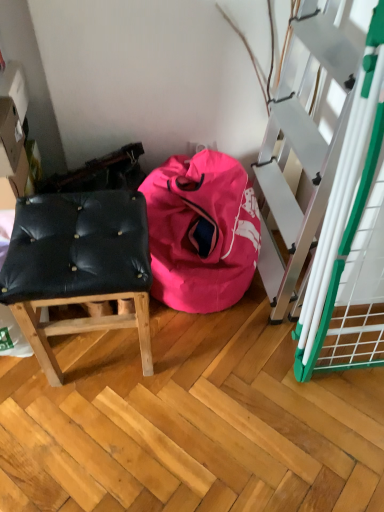
Question: Could you tell me if pink fabric bean bag at center is turned towards black leather stool at left?

Choices:
 (A) yes
 (B) no

Answer: (B)

Question: Does pink fabric bean bag at center have a greater height compared to black leather stool at left?

Choices:
 (A) no
 (B) yes

Answer: (A)

Question: Is pink fabric bean bag at center shorter than black leather stool at left?

Choices:
 (A) no
 (B) yes

Answer: (B)

Question: From the image's perspective, is pink fabric bean bag at center located beneath black leather stool at left?

Choices:
 (A) no
 (B) yes

Answer: (A)

Question: Is pink fabric bean bag at center beside black leather stool at left?

Choices:
 (A) yes
 (B) no

Answer: (B)

Question: Can you confirm if pink fabric bean bag at center is positioned to the right of black leather stool at left?

Choices:
 (A) no
 (B) yes

Answer: (B)

Question: Is black leather stool at left surrounding pink fabric bean bag at center?

Choices:
 (A) no
 (B) yes

Answer: (A)

Question: Does black leather stool at left have a greater width compared to pink fabric bean bag at center?

Choices:
 (A) yes
 (B) no

Answer: (B)

Question: Is black leather stool at left far away from pink fabric bean bag at center?

Choices:
 (A) no
 (B) yes

Answer: (A)

Question: From a real-world perspective, is black leather stool at left positioned under pink fabric bean bag at center based on gravity?

Choices:
 (A) no
 (B) yes

Answer: (A)

Question: From a real-world perspective, is black leather stool at left on top of pink fabric bean bag at center?

Choices:
 (A) no
 (B) yes

Answer: (B)

Question: Is black leather stool at left taller than pink fabric bean bag at center?

Choices:
 (A) yes
 (B) no

Answer: (A)

Question: Is point (79, 252) positioned closer to the camera than point (216, 253)?

Choices:
 (A) farther
 (B) closer

Answer: (B)